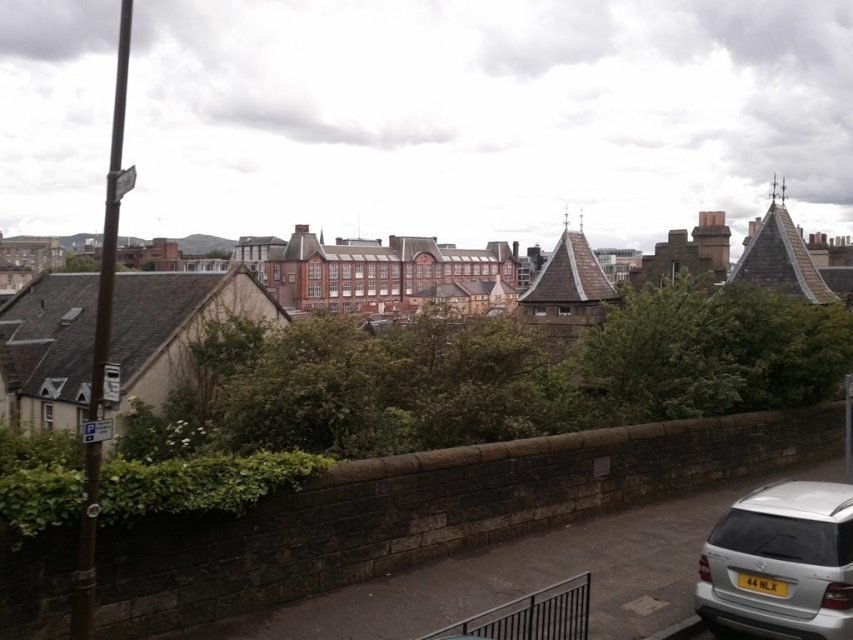
Could you measure the distance between silver metallic suv at lower right and yellow matte license plate at lower right?

silver metallic suv at lower right and yellow matte license plate at lower right are 67.38 centimeters apart.

Is silver metallic suv at lower right further to the viewer compared to yellow matte license plate at lower right?

No.

Locate an element on the screen. silver metallic suv at lower right is located at coordinates (780, 563).